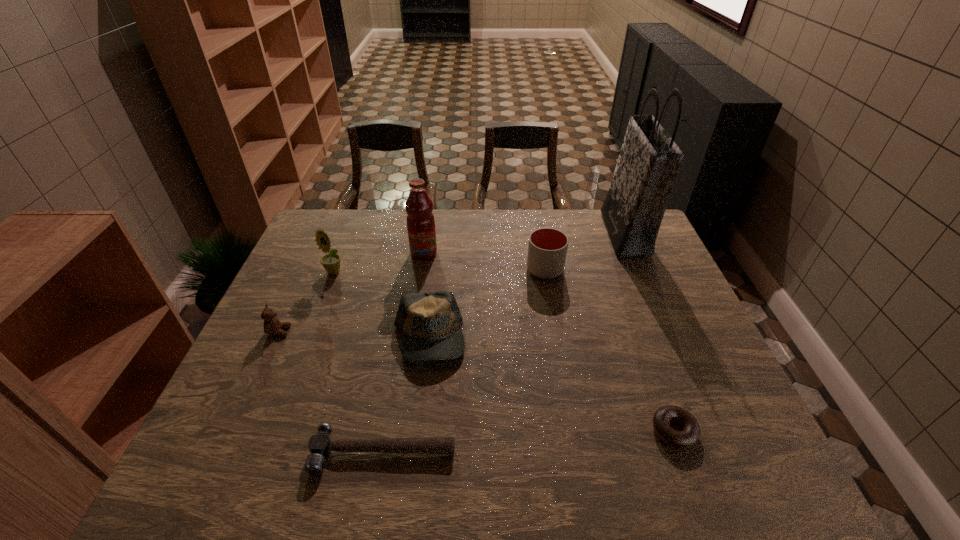
The width and height of the screenshot is (960, 540). I want to click on shopping bag, so click(x=649, y=161).

The height and width of the screenshot is (540, 960). I want to click on fruit juice, so (x=420, y=220).

I want to click on the sixth shortest object, so click(x=331, y=262).

Locate an element on the screen. This screenshot has height=540, width=960. sunflower is located at coordinates (331, 262).

Locate an element on the screen. the third object from right to left is located at coordinates (547, 249).

Identify the location of cup. This screenshot has height=540, width=960. (547, 249).

Find the location of a particular element. The image size is (960, 540). baseball cap is located at coordinates (430, 324).

Locate an element on the screen. the leftmost object is located at coordinates (272, 325).

Locate an element on the screen. Image resolution: width=960 pixels, height=540 pixels. doughnut is located at coordinates (691, 433).

Where is `hammer`? hammer is located at coordinates (320, 445).